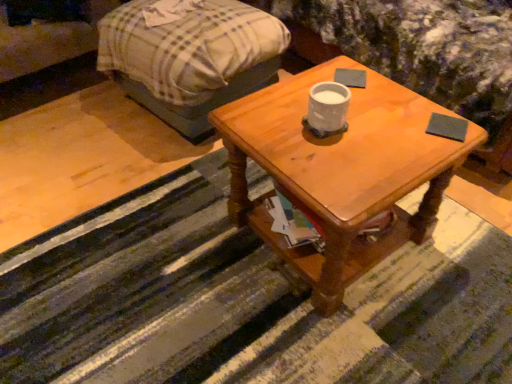
Where is `vacant space that is in between dark gray matte pad at upper center, placed as the second pad when sorted from bottom to top, and dark gray matte pad at upper right, the first pad when ordered from right to left`? Image resolution: width=512 pixels, height=384 pixels. vacant space that is in between dark gray matte pad at upper center, placed as the second pad when sorted from bottom to top, and dark gray matte pad at upper right, the first pad when ordered from right to left is located at coordinates (396, 100).